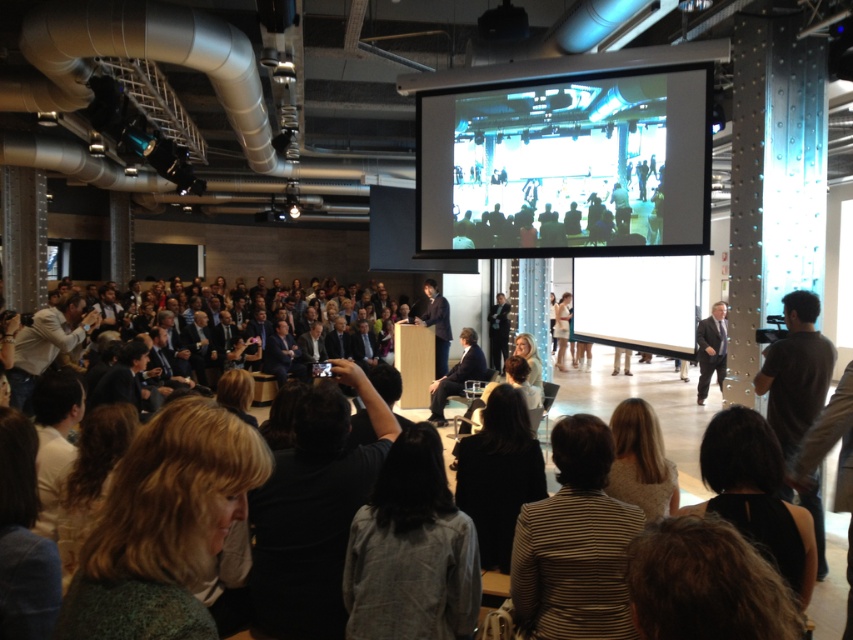
Does green textured sweater at lower left have a greater height compared to light beige fabric dress at center?

No.

From the picture: Is green textured sweater at lower left above light beige fabric dress at center?

No, green textured sweater at lower left is not above light beige fabric dress at center.

Does point (233, 520) lie behind point (566, 307)?

No, it is in front of (566, 307).

The height and width of the screenshot is (640, 853). In order to click on green textured sweater at lower left in this screenshot , I will do `click(164, 525)`.

Who is higher up, white glossy screen at upper center or striped fabric jacket at center?

white glossy screen at upper center is higher up.

Between point (453, 152) and point (601, 547), which one is positioned behind?

The point (453, 152) is behind.

Is point (532, 108) positioned before point (585, 632)?

No, it is behind (585, 632).

In order to click on white glossy screen at upper center in this screenshot , I will do `click(566, 166)`.

Who is higher up, blonde hair at center or light beige fabric dress at center?

light beige fabric dress at center

What do you see at coordinates (641, 460) in the screenshot? I see `blonde hair at center` at bounding box center [641, 460].

Find the location of a particular element. blonde hair at center is located at coordinates (641, 460).